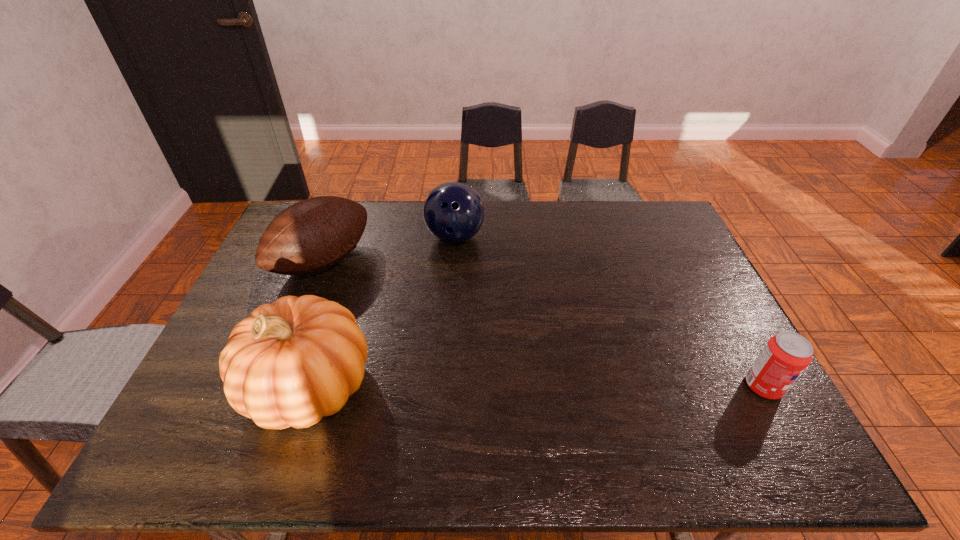
Locate an element on the screen. This screenshot has width=960, height=540. blank space that satisfies the following two spatial constraints: 1. on the front side of the bowling ball; 2. on the surface of the soda can is located at coordinates (444, 386).